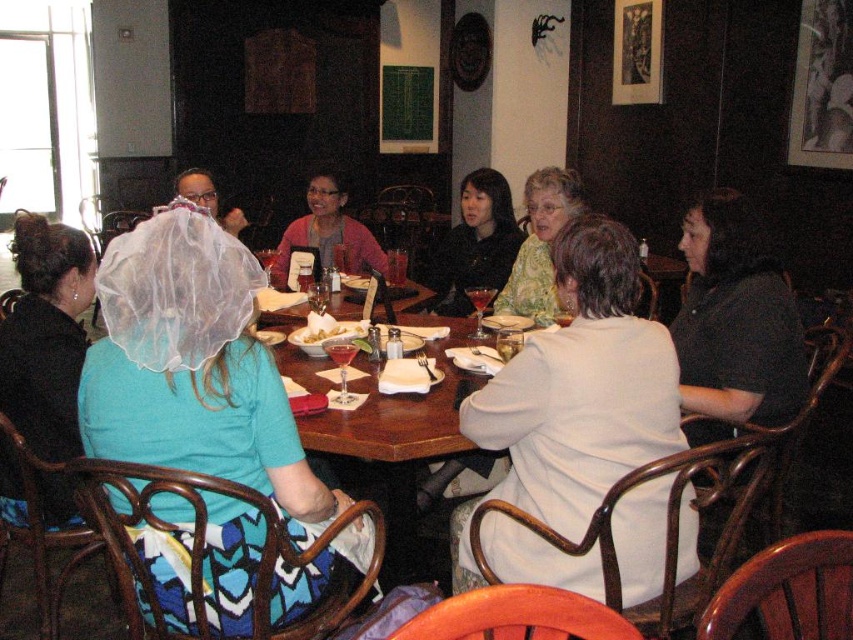
Question: Which point appears farthest from the camera in this image?

Choices:
 (A) (422, 449)
 (B) (341, 337)
 (C) (569, 170)
 (D) (192, 193)

Answer: (D)

Question: Is white mesh hat at left to the right of black fabric hairnet at upper left from the viewer's perspective?

Choices:
 (A) yes
 (B) no

Answer: (A)

Question: Can you confirm if white cotton blouse at center is positioned below matte pink sweater at center?

Choices:
 (A) yes
 (B) no

Answer: (A)

Question: Which object is closer to the camera taking this photo?

Choices:
 (A) black matte shirt at right
 (B) smooth white bowl at center
 (C) white netting hat at upper left
 (D) wooden table at center

Answer: (D)

Question: Among these points, which one is farthest from the camera?

Choices:
 (A) (302, 524)
 (B) (337, 332)
 (C) (537, 275)
 (D) (361, 259)

Answer: (D)

Question: Can you confirm if black fabric hairnet at upper left is positioned to the right of matte pink sweater at center?

Choices:
 (A) no
 (B) yes

Answer: (A)